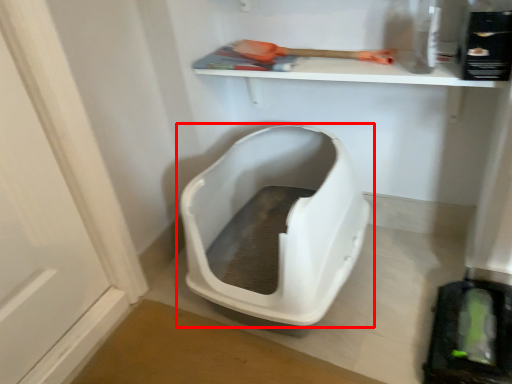
Question: From the image's perspective, what is the correct spatial relationship of toilet (annotated by the red box) in relation to tool?

Choices:
 (A) above
 (B) below

Answer: (B)